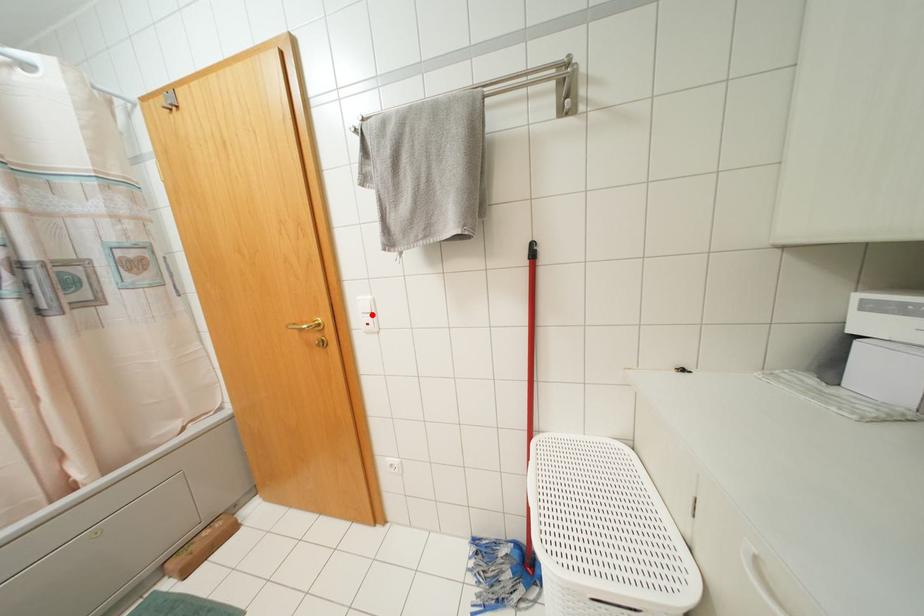
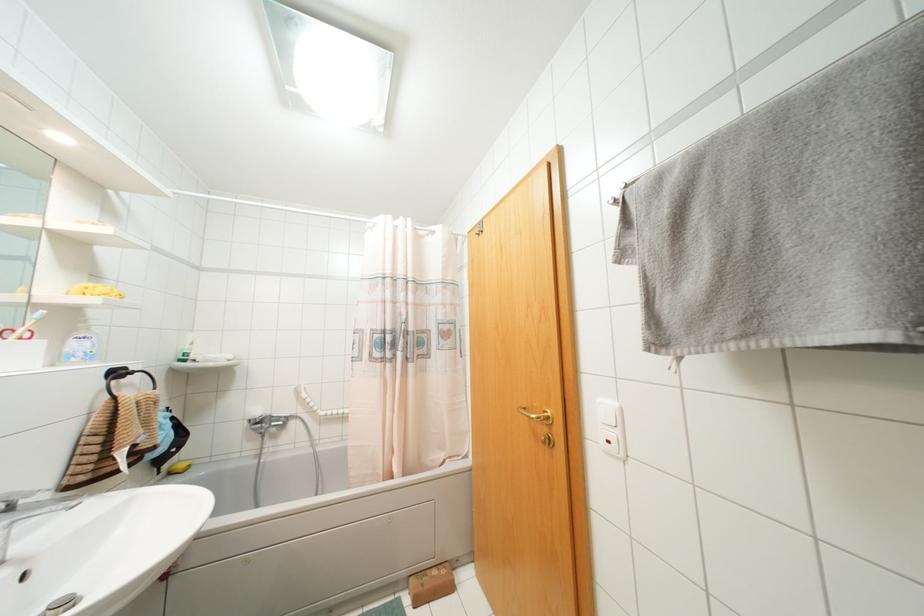
Where in the second image is the point corresponding to the highlighted location from the first image?

(617, 431)